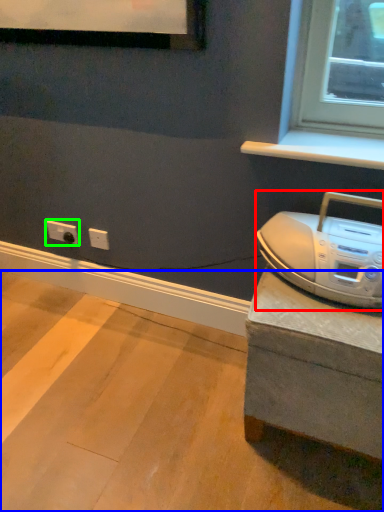
Question: Which object is the closest to the home appliance (highlighted by a red box)? Choose among these: concrete (highlighted by a blue box) or electric outlet (highlighted by a green box).

Choices:
 (A) concrete
 (B) electric outlet

Answer: (A)